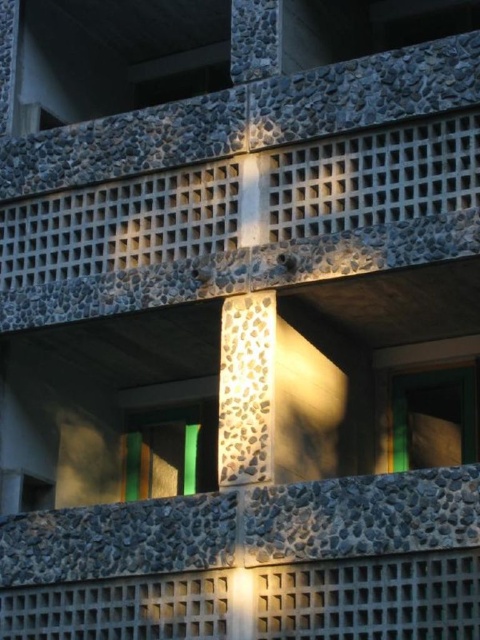
Question: Does green glass window at lower right appear under green glass window at center?

Choices:
 (A) no
 (B) yes

Answer: (B)

Question: Does green glass window at lower right have a smaller size compared to green glass window at center?

Choices:
 (A) no
 (B) yes

Answer: (A)

Question: Does green glass window at lower right appear on the right side of green glass window at center?

Choices:
 (A) no
 (B) yes

Answer: (B)